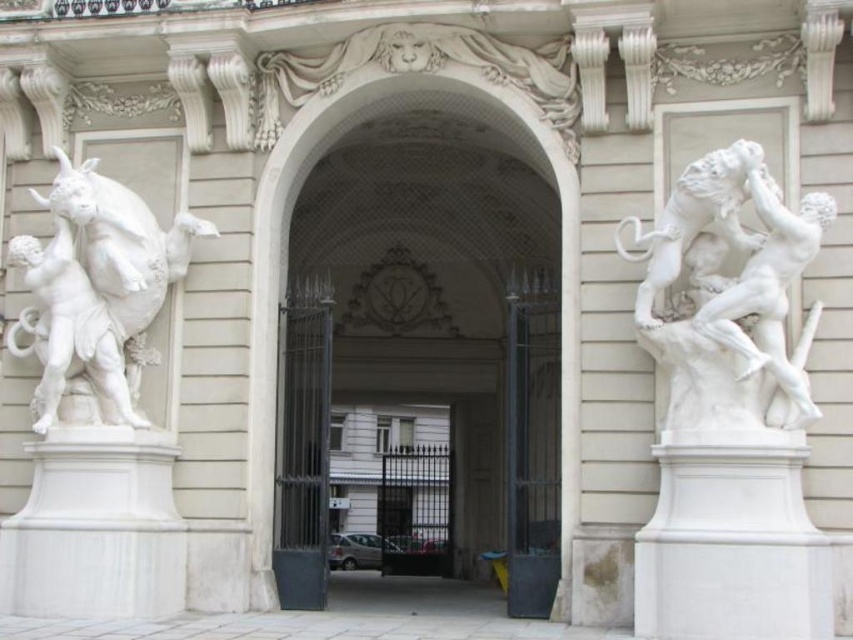
Question: Is white marble archway at center to the right of white marble statue at left from the viewer's perspective?

Choices:
 (A) no
 (B) yes

Answer: (B)

Question: Observing the image, what is the correct spatial positioning of white marble sculpture at right in reference to white marble archway at center?

Choices:
 (A) right
 (B) left

Answer: (A)

Question: Which point is farther to the camera?

Choices:
 (A) (537, 118)
 (B) (103, 392)

Answer: (A)

Question: Can you confirm if white marble archway at center is positioned above white marble statue at left?

Choices:
 (A) yes
 (B) no

Answer: (B)

Question: Which is nearer to the white marble statue at left?

Choices:
 (A) white marble sculpture at right
 (B) white marble archway at center

Answer: (B)

Question: Which point is farther from the camera taking this photo?

Choices:
 (A) (706, 182)
 (B) (125, 308)

Answer: (B)